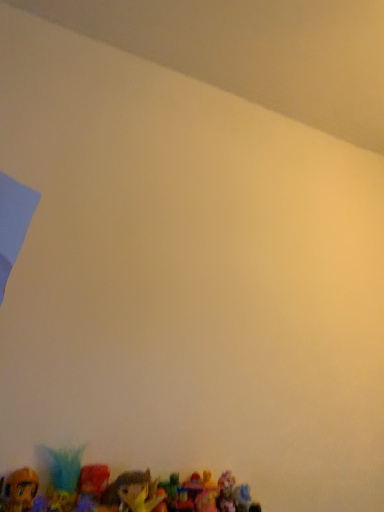
The height and width of the screenshot is (512, 384). Describe the element at coordinates (20, 490) in the screenshot. I see `shiny plastic toy at lower left, the 1th toy positioned from the left` at that location.

Measure the distance between plush toy at bottom, the second toy viewed from the right, and camera.

They are 29.65 inches apart.

Where is `plush toy at bottom, the second toy viewed from the right`? The width and height of the screenshot is (384, 512). plush toy at bottom, the second toy viewed from the right is located at coordinates (63, 478).

This screenshot has width=384, height=512. Find the location of `shiny plastic toy at lower center, which is counted as the 3th toy, starting from the left`. shiny plastic toy at lower center, which is counted as the 3th toy, starting from the left is located at coordinates (131, 493).

Where is `shiny plastic toy at lower left, the 3th toy viewed from the right`? Image resolution: width=384 pixels, height=512 pixels. shiny plastic toy at lower left, the 3th toy viewed from the right is located at coordinates (20, 490).

Considering the relative positions of shiny plastic toy at lower left, the 3th toy viewed from the right, and shiny plastic toy at lower center, marked as the first toy in a right-to-left arrangement, in the image provided, is shiny plastic toy at lower left, the 3th toy viewed from the right, to the left of shiny plastic toy at lower center, marked as the first toy in a right-to-left arrangement, from the viewer's perspective?

Correct, you'll find shiny plastic toy at lower left, the 3th toy viewed from the right, to the left of shiny plastic toy at lower center, marked as the first toy in a right-to-left arrangement.

Who is shorter, shiny plastic toy at lower left, the 1th toy positioned from the left, or shiny plastic toy at lower center, marked as the first toy in a right-to-left arrangement?

With less height is shiny plastic toy at lower center, marked as the first toy in a right-to-left arrangement.

Does point (28, 482) appear closer or farther from the camera than point (113, 505)?

Point (28, 482) is positioned closer to the camera compared to point (113, 505).

From a real-world perspective, is plush toy at bottom, which is counted as the 2th toy, starting from the left, physically below shiny plastic toy at lower left, the 1th toy positioned from the left?

Incorrect, from a real-world perspective, plush toy at bottom, which is counted as the 2th toy, starting from the left, is higher than shiny plastic toy at lower left, the 1th toy positioned from the left.

Is point (54, 509) farther from viewer compared to point (7, 511)?

Yes, it is behind point (7, 511).

How many degrees apart are the facing directions of plush toy at bottom, the second toy viewed from the right, and shiny plastic toy at lower left, the 3th toy viewed from the right?

plush toy at bottom, the second toy viewed from the right, and shiny plastic toy at lower left, the 3th toy viewed from the right, are facing 0.00948 degrees away from each other.

Which toy is the 1st one when counting from the front of the plush toy at bottom, which is counted as the 2th toy, starting from the left? Please provide its 2D coordinates.

[(20, 490)]

From a real-world perspective, is shiny plastic toy at lower center, marked as the first toy in a right-to-left arrangement, on shiny plastic toy at lower left, the 1th toy positioned from the left?

Actually, shiny plastic toy at lower center, marked as the first toy in a right-to-left arrangement, is physically below shiny plastic toy at lower left, the 1th toy positioned from the left, in the real world.

Are shiny plastic toy at lower center, marked as the first toy in a right-to-left arrangement, and shiny plastic toy at lower left, the 1th toy positioned from the left, beside each other?

shiny plastic toy at lower center, marked as the first toy in a right-to-left arrangement, and shiny plastic toy at lower left, the 1th toy positioned from the left, are not in contact.

Considering the points (152, 495) and (31, 505), which point is in front, point (152, 495) or point (31, 505)?

The point (31, 505) is in front.

Is shiny plastic toy at lower left, the 1th toy positioned from the left, at the back of shiny plastic toy at lower center, which is counted as the 3th toy, starting from the left?

No, shiny plastic toy at lower center, which is counted as the 3th toy, starting from the left, is not facing away from shiny plastic toy at lower left, the 1th toy positioned from the left.

Considering the relative sizes of shiny plastic toy at lower center, which is counted as the 3th toy, starting from the left, and plush toy at bottom, which is counted as the 2th toy, starting from the left, in the image provided, is shiny plastic toy at lower center, which is counted as the 3th toy, starting from the left, wider than plush toy at bottom, which is counted as the 2th toy, starting from the left,?

Yes, shiny plastic toy at lower center, which is counted as the 3th toy, starting from the left, is wider than plush toy at bottom, which is counted as the 2th toy, starting from the left.

Is shiny plastic toy at lower center, which is counted as the 3th toy, starting from the left, not close to plush toy at bottom, the second toy viewed from the right?

No, shiny plastic toy at lower center, which is counted as the 3th toy, starting from the left, is not far away from plush toy at bottom, the second toy viewed from the right.

Between shiny plastic toy at lower center, which is counted as the 3th toy, starting from the left, and plush toy at bottom, which is counted as the 2th toy, starting from the left, which one appears on the right side from the viewer's perspective?

From the viewer's perspective, shiny plastic toy at lower center, which is counted as the 3th toy, starting from the left, appears more on the right side.

From the picture: From the image's perspective, relative to plush toy at bottom, which is counted as the 2th toy, starting from the left, is shiny plastic toy at lower center, which is counted as the 3th toy, starting from the left, above or below?

Clearly, from the image's perspective, shiny plastic toy at lower center, which is counted as the 3th toy, starting from the left, is below plush toy at bottom, which is counted as the 2th toy, starting from the left.

Would you say plush toy at bottom, the second toy viewed from the right, is to the left or to the right of shiny plastic toy at lower center, marked as the first toy in a right-to-left arrangement, in the picture?

Clearly, plush toy at bottom, the second toy viewed from the right, is on the left of shiny plastic toy at lower center, marked as the first toy in a right-to-left arrangement, in the image.

Which is nearer, (62,490) or (150,509)?

Positioned in front is point (150,509).

From the image's perspective, is plush toy at bottom, which is counted as the 2th toy, starting from the left, above or below shiny plastic toy at lower center, marked as the first toy in a right-to-left arrangement?

Clearly, from the image's perspective, plush toy at bottom, which is counted as the 2th toy, starting from the left, is above shiny plastic toy at lower center, marked as the first toy in a right-to-left arrangement.

Is plush toy at bottom, the second toy viewed from the right, next to shiny plastic toy at lower center, which is counted as the 3th toy, starting from the left?

Indeed, plush toy at bottom, the second toy viewed from the right, and shiny plastic toy at lower center, which is counted as the 3th toy, starting from the left, are beside each other and touching.

Between shiny plastic toy at lower left, the 1th toy positioned from the left, and plush toy at bottom, which is counted as the 2th toy, starting from the left, which one has smaller size?

With smaller size is shiny plastic toy at lower left, the 1th toy positioned from the left.

From the image's perspective, is shiny plastic toy at lower left, the 1th toy positioned from the left, above or below plush toy at bottom, which is counted as the 2th toy, starting from the left?

From the image's perspective, shiny plastic toy at lower left, the 1th toy positioned from the left, appears above plush toy at bottom, which is counted as the 2th toy, starting from the left.

Considering the sizes of objects shiny plastic toy at lower left, the 3th toy viewed from the right, and plush toy at bottom, which is counted as the 2th toy, starting from the left, in the image provided, who is taller, shiny plastic toy at lower left, the 3th toy viewed from the right, or plush toy at bottom, which is counted as the 2th toy, starting from the left,?

plush toy at bottom, which is counted as the 2th toy, starting from the left.

Which of these two, shiny plastic toy at lower left, the 3th toy viewed from the right, or plush toy at bottom, which is counted as the 2th toy, starting from the left, is wider?

Wider between the two is plush toy at bottom, which is counted as the 2th toy, starting from the left.

At what (x,y) coordinates should I click in order to perform the action: click on toy in front of the shiny plastic toy at lower left, the 3th toy viewed from the right. Please return your answer as a coordinate pair (x, y). This screenshot has height=512, width=384. Looking at the image, I should click on click(x=131, y=493).

This screenshot has height=512, width=384. What are the coordinates of `toy that appears above the shiny plastic toy at lower left, the 3th toy viewed from the right (from a real-world perspective)` in the screenshot? It's located at (63, 478).

From the image, which object appears to be farther from plush toy at bottom, the second toy viewed from the right, shiny plastic toy at lower center, marked as the first toy in a right-to-left arrangement, or shiny plastic toy at lower left, the 3th toy viewed from the right?

The object further to plush toy at bottom, the second toy viewed from the right, is shiny plastic toy at lower center, marked as the first toy in a right-to-left arrangement.

Based on their spatial positions, is shiny plastic toy at lower center, marked as the first toy in a right-to-left arrangement, or plush toy at bottom, the second toy viewed from the right, closer to shiny plastic toy at lower left, the 3th toy viewed from the right?

Among the two, plush toy at bottom, the second toy viewed from the right, is located nearer to shiny plastic toy at lower left, the 3th toy viewed from the right.

Estimate the real-world distances between objects in this image. Which object is closer to shiny plastic toy at lower center, marked as the first toy in a right-to-left arrangement, plush toy at bottom, the second toy viewed from the right, or shiny plastic toy at lower left, the 3th toy viewed from the right?

plush toy at bottom, the second toy viewed from the right, lies closer to shiny plastic toy at lower center, marked as the first toy in a right-to-left arrangement, than the other object.

Looking at the image, which one is located further to plush toy at bottom, which is counted as the 2th toy, starting from the left, shiny plastic toy at lower left, the 3th toy viewed from the right, or shiny plastic toy at lower center, marked as the first toy in a right-to-left arrangement?

shiny plastic toy at lower center, marked as the first toy in a right-to-left arrangement, is further to plush toy at bottom, which is counted as the 2th toy, starting from the left.

Which object lies further to the anchor point shiny plastic toy at lower left, the 3th toy viewed from the right, plush toy at bottom, the second toy viewed from the right, or shiny plastic toy at lower center, marked as the first toy in a right-to-left arrangement?

shiny plastic toy at lower center, marked as the first toy in a right-to-left arrangement, lies further to shiny plastic toy at lower left, the 3th toy viewed from the right, than the other object.

Based on their spatial positions, is shiny plastic toy at lower left, the 1th toy positioned from the left, or plush toy at bottom, the second toy viewed from the right, closer to shiny plastic toy at lower center, marked as the first toy in a right-to-left arrangement?

plush toy at bottom, the second toy viewed from the right.

The height and width of the screenshot is (512, 384). Identify the location of toy located between shiny plastic toy at lower left, the 1th toy positioned from the left, and shiny plastic toy at lower center, which is counted as the 3th toy, starting from the left, in the left-right direction. (63, 478).